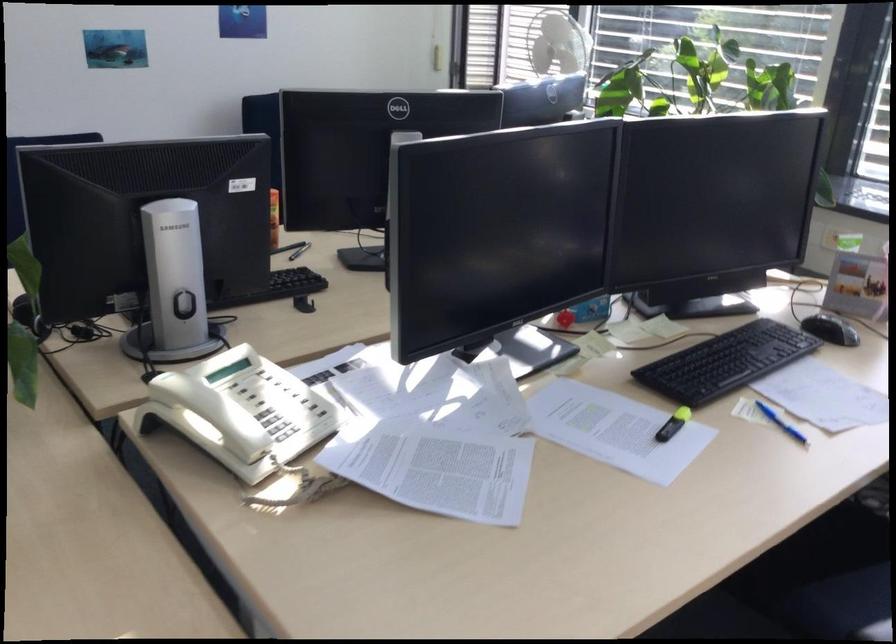
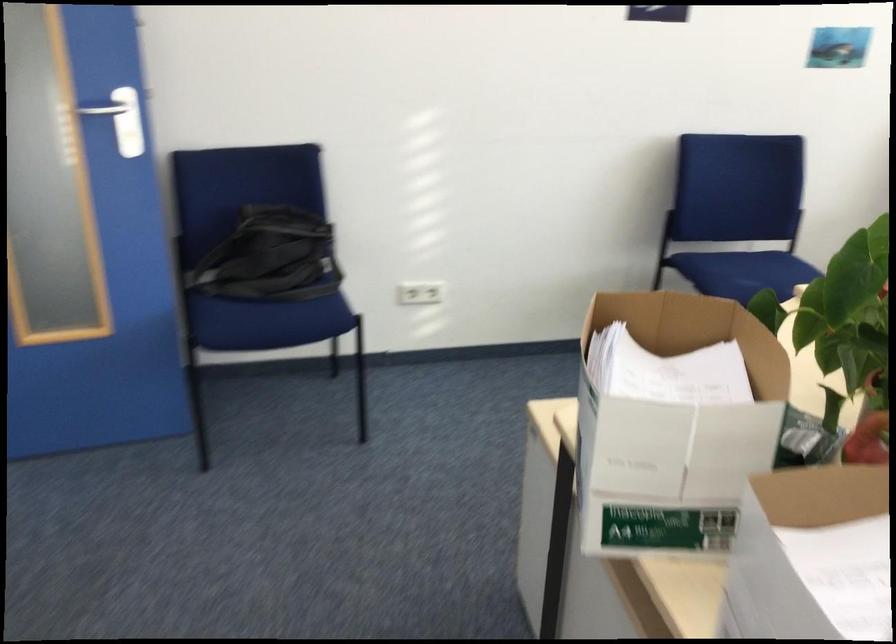
Question: Based on the continuous images, in which direction is the camera rotating? Reply with the corresponding letter.

Choices:
 (A) Left
 (B) Right
 (C) Up
 (D) Down

Answer: (A)